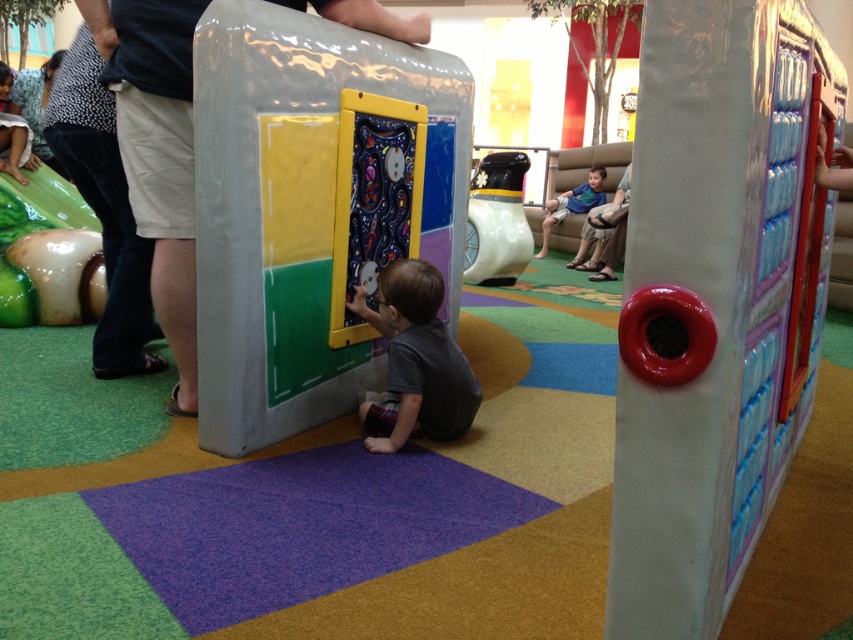
Consider the image. Is smooth plastic door at center wider than blue cotton shirt at upper center?

Indeed, smooth plastic door at center has a greater width compared to blue cotton shirt at upper center.

Identify the location of smooth plastic door at center. (717, 300).

Where is `smooth plastic door at center`? The image size is (853, 640). smooth plastic door at center is located at coordinates 717,300.

Can you confirm if light gray shorts at left is taller than blue cotton shirt at upper center?

Indeed, light gray shorts at left has a greater height compared to blue cotton shirt at upper center.

Is light gray shorts at left thinner than blue cotton shirt at upper center?

Yes.

Is point (184, 144) closer to viewer compared to point (540, 253)?

Yes, point (184, 144) is in front of point (540, 253).

At what (x,y) coordinates should I click in order to perform the action: click on light gray shorts at left. Please return your answer as a coordinate pair (x, y). Looking at the image, I should click on (157, 150).

You are a GUI agent. You are given a task and a screenshot of the screen. Output one action in this format:
    pyautogui.click(x=<x>, y=<y>)
    Task: Click on the dark gray pants at left
    The height and width of the screenshot is (640, 853).
    Given the screenshot: What is the action you would take?
    pyautogui.click(x=103, y=209)

Which is in front, point (115, 353) or point (550, 212)?

Point (115, 353) is more forward.

Does point (113, 150) come closer to viewer compared to point (595, 195)?

Yes.

Identify the location of dark gray pants at left. This screenshot has width=853, height=640. (103, 209).